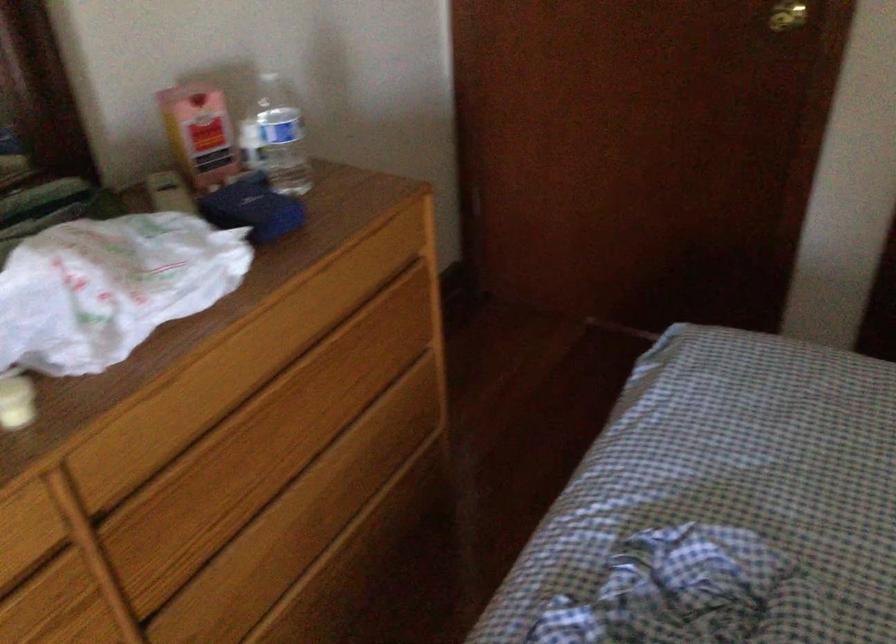
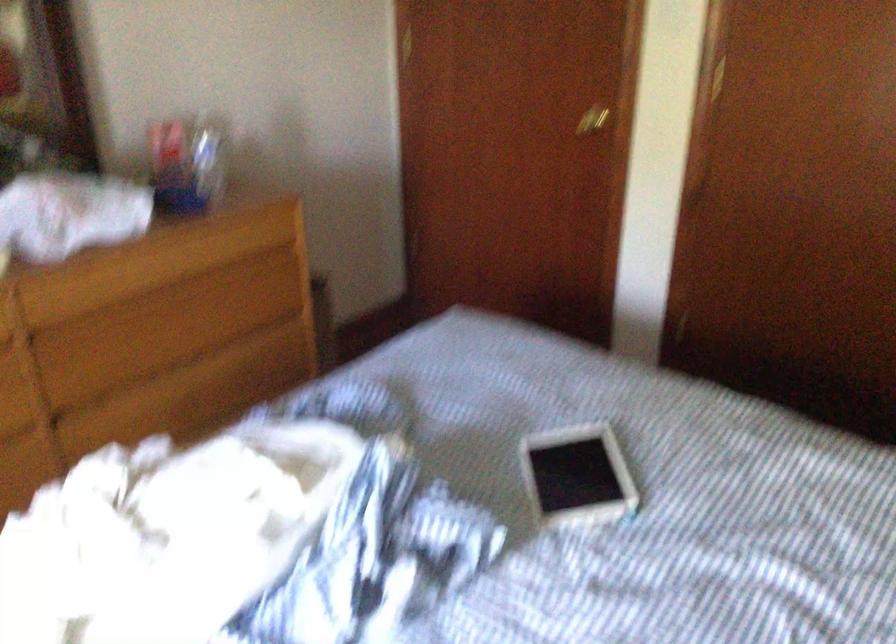
In the second image, find the point that corresponds to (282,136) in the first image.

(208, 156)